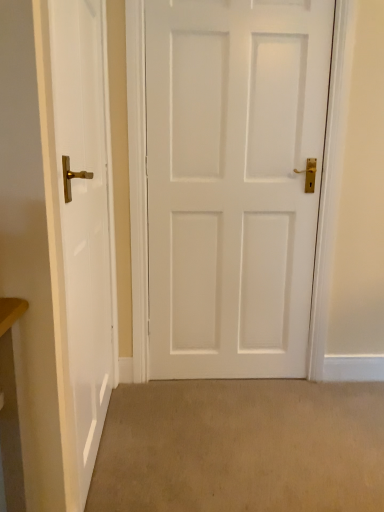
Question: Is point (153, 297) positioned closer to the camera than point (130, 485)?

Choices:
 (A) closer
 (B) farther

Answer: (B)

Question: In the image, is white matte door at center, placed as the 1th door when sorted from right to left, positioned in front of or behind beige carpet at lower center?

Choices:
 (A) front
 (B) behind

Answer: (B)

Question: Which object is the farthest from the beige carpet at lower center?

Choices:
 (A) white matte door at center, placed as the 1th door when sorted from right to left
 (B) white glossy door at left, the 2th door from the right

Answer: (A)

Question: Estimate the real-world distances between objects in this image. Which object is farther from the white glossy door at left, which appears as the 1th door when viewed from the left?

Choices:
 (A) white matte door at center, placed as the 1th door when sorted from right to left
 (B) beige carpet at lower center

Answer: (B)